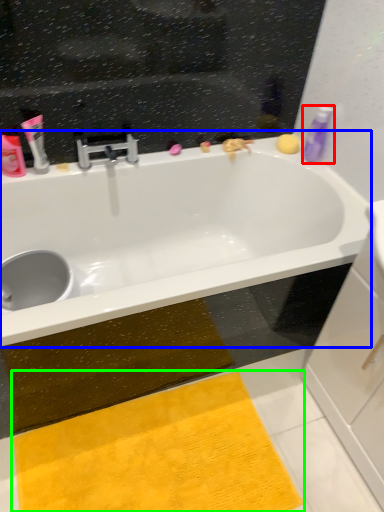
Question: Estimate the real-world distances between objects in this image. Which object is farther from toiletry (highlighted by a red box), bathtub (highlighted by a blue box) or doormat (highlighted by a green box)?

Choices:
 (A) bathtub
 (B) doormat

Answer: (B)